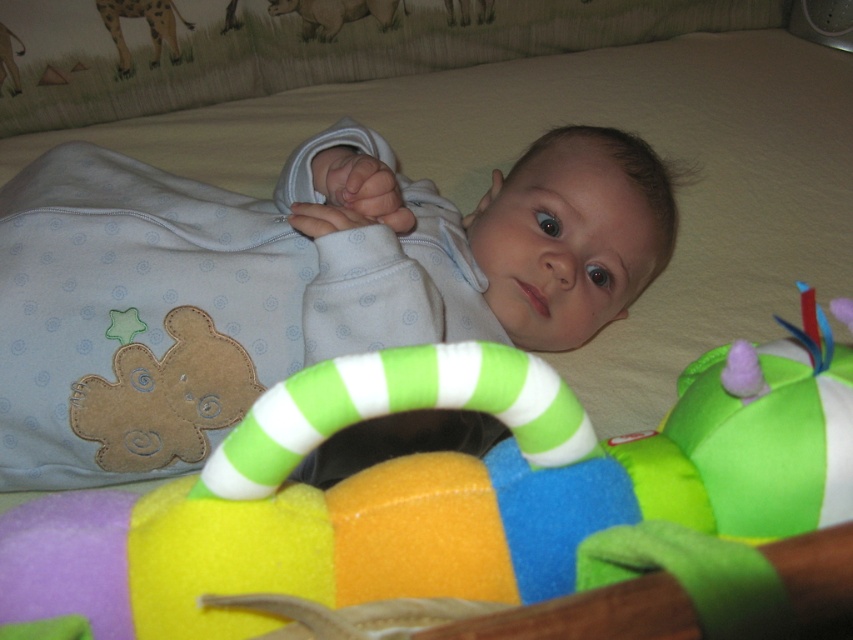
Which is above, matte white onesie at center or spotted fur giraffe at upper left?

spotted fur giraffe at upper left is above.

Looking at this image, who is more forward, (379, 456) or (109, 8)?

Positioned in front is point (379, 456).

Which is behind, point (442, 305) or point (167, 38)?

Point (167, 38)

This screenshot has width=853, height=640. In order to click on matte white onesie at center in this screenshot , I will do `click(477, 243)`.

This screenshot has width=853, height=640. Describe the element at coordinates (148, 26) in the screenshot. I see `spotted fur giraffe at upper left` at that location.

Between spotted fur giraffe at upper left and brown textured elephant at upper center, which one has less height?

brown textured elephant at upper center

Which is in front, point (167, 19) or point (328, 38)?

Positioned in front is point (167, 19).

This screenshot has width=853, height=640. I want to click on spotted fur giraffe at upper left, so click(x=148, y=26).

Is matte white onesie at center below brown textured elephant at upper center?

Yes, matte white onesie at center is below brown textured elephant at upper center.

The image size is (853, 640). What are the coordinates of `matte white onesie at center` in the screenshot? It's located at (477, 243).

Does point (556, 230) come closer to viewer compared to point (318, 19)?

Yes, point (556, 230) is closer to viewer.

Find the location of a particular element. matte white onesie at center is located at coordinates (477, 243).